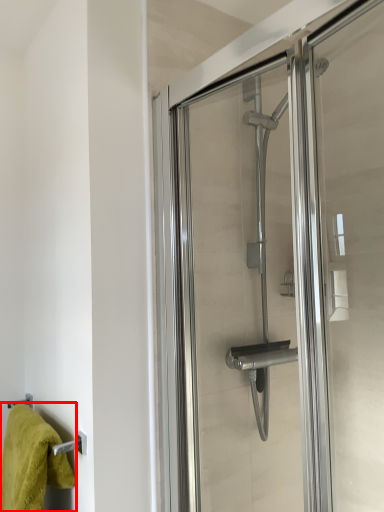
Question: From the image's perspective, what is the correct spatial relationship of towel (annotated by the red box) in relation to screen door?

Choices:
 (A) below
 (B) above

Answer: (A)